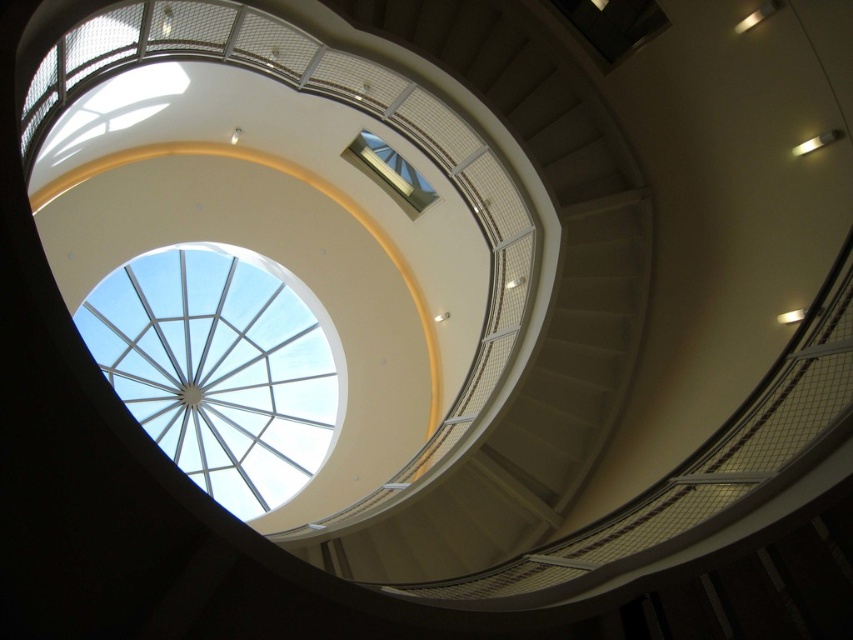
You are an architect evaluating the space. You need to install a safety net between the white matte staircase at center and the transparent glass dome at upper center. Based on their positions, which object should the net be anchored closer to the viewer?

The white matte staircase at center is closer to the viewer than the transparent glass dome at upper center, so the safety net should be anchored closer to the white matte staircase at center.

You are standing at the entrance of the spiral staircase in the modern architectural interior. You notice a point marked at coordinates (547, 307). Can you determine if this point corresponds to the location of the white matte staircase at center?

The white matte staircase at center is represented by point (547, 307), so yes, the point marked at coordinates (547, 307) corresponds to the location of the white matte staircase at center.